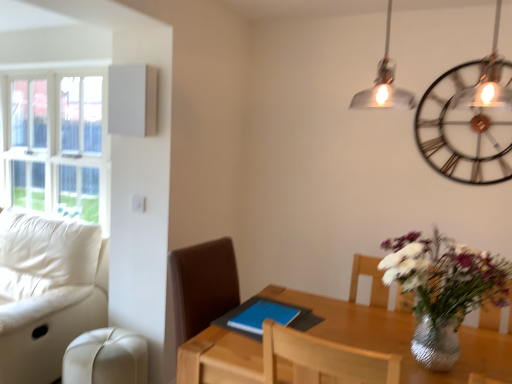
At what (x,y) coordinates should I click in order to perform the action: click on empty space that is ontop of metallic/textured wall clock at upper right. Please return your answer as a coordinate pair (x, y). This screenshot has height=384, width=512. Looking at the image, I should click on (470, 62).